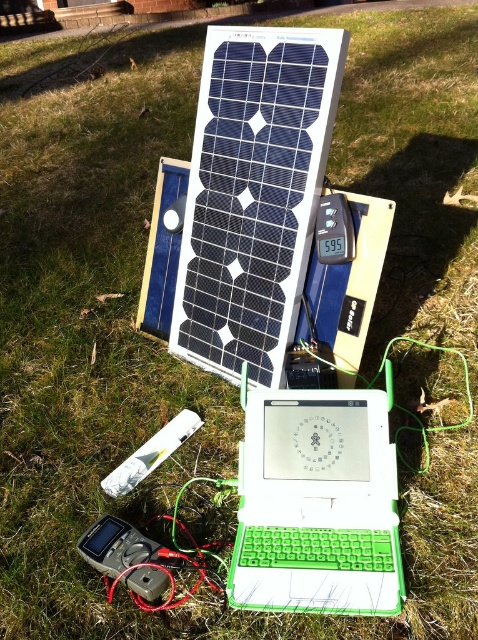
Question: Can you confirm if green plastic laptop at center is positioned to the right of gray plastic multimeter at lower left?

Choices:
 (A) yes
 (B) no

Answer: (A)

Question: Does green plastic laptop at center have a lesser width compared to gray plastic multimeter at lower left?

Choices:
 (A) no
 (B) yes

Answer: (A)

Question: Can you confirm if green plastic laptop at center is wider than gray plastic multimeter at lower left?

Choices:
 (A) no
 (B) yes

Answer: (B)

Question: Which point appears farthest from the camera in this image?

Choices:
 (A) (281, 410)
 (B) (97, 545)

Answer: (A)

Question: Which point appears closest to the camera in this image?

Choices:
 (A) (140, 534)
 (B) (315, 573)

Answer: (B)